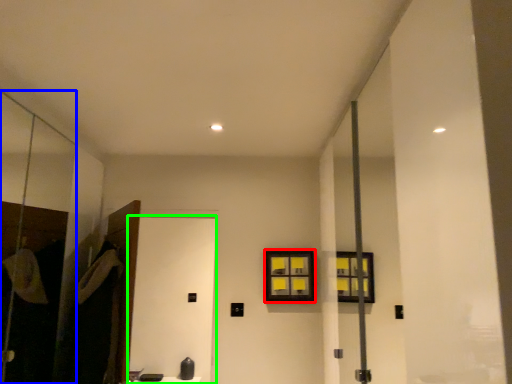
Question: Which object is the closest to the window (highlighted by a red box)? Choose among these: screen door (highlighted by a blue box) or screen door (highlighted by a green box).

Choices:
 (A) screen door
 (B) screen door

Answer: (A)